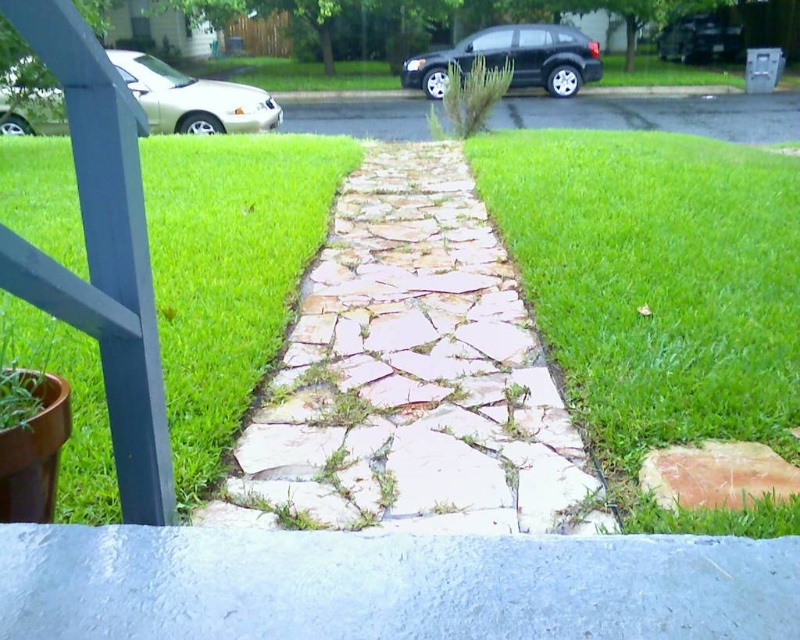
Question: Which object is positioned closest to the silver metallic sedan at upper left?

Choices:
 (A) green grass at center
 (B) natural stone path at center
 (C) black matte car at upper center
 (D) green grass at left

Answer: (D)

Question: Which object is the farthest from the green grass at center?

Choices:
 (A) natural stone path at center
 (B) green grass at left
 (C) metallic dark gray sedan at upper right

Answer: (C)

Question: Does natural stone path at center appear under green grass at left?

Choices:
 (A) no
 (B) yes

Answer: (B)

Question: Which object is farther from the camera taking this photo?

Choices:
 (A) black matte car at upper center
 (B) metallic dark gray sedan at upper right
 (C) silver metallic sedan at upper left
 (D) green grass at left

Answer: (B)

Question: Does green grass at center appear under silver metallic sedan at upper left?

Choices:
 (A) no
 (B) yes

Answer: (B)

Question: Can you confirm if green grass at left is positioned above metallic dark gray sedan at upper right?

Choices:
 (A) no
 (B) yes

Answer: (A)